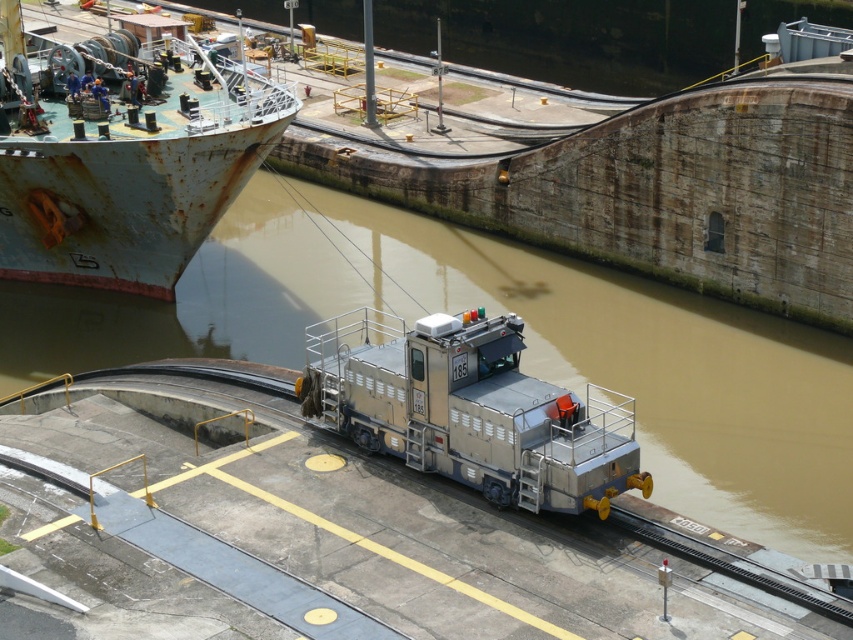
You are an engineer assessing the lock system. The lock has a maximum width capacity of 50 meters. Given the rusty metal ship at upper left and the metallic gray locomotive at center, which one can safely pass through the lock without exceeding its width limit?

The metallic gray locomotive at center can safely pass through the lock since the rusty metal ship at upper left is wider than the locomotive and exceeds the 50 meters width limit.

You are standing at the observation deck overlooking the lock system. You see the rusty metal ship at upper left and the metallic gray locomotive at center. Which object is closer to you?

The rusty metal ship at upper left is closer to you because it is further to the viewer than the metallic gray locomotive at center.